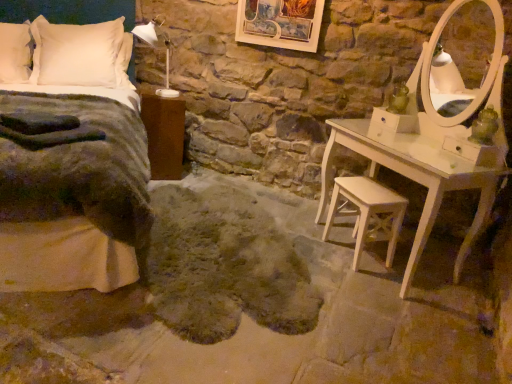
Where is `free point behind white wood stool at lower right`? free point behind white wood stool at lower right is located at coordinates (333, 232).